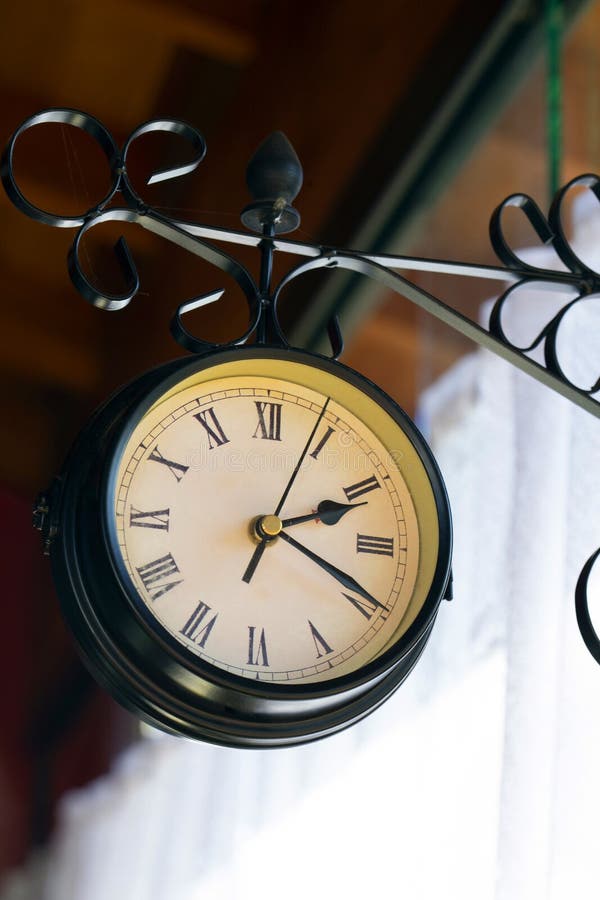
Where is `curtains`? The image size is (600, 900). curtains is located at coordinates (537, 474).